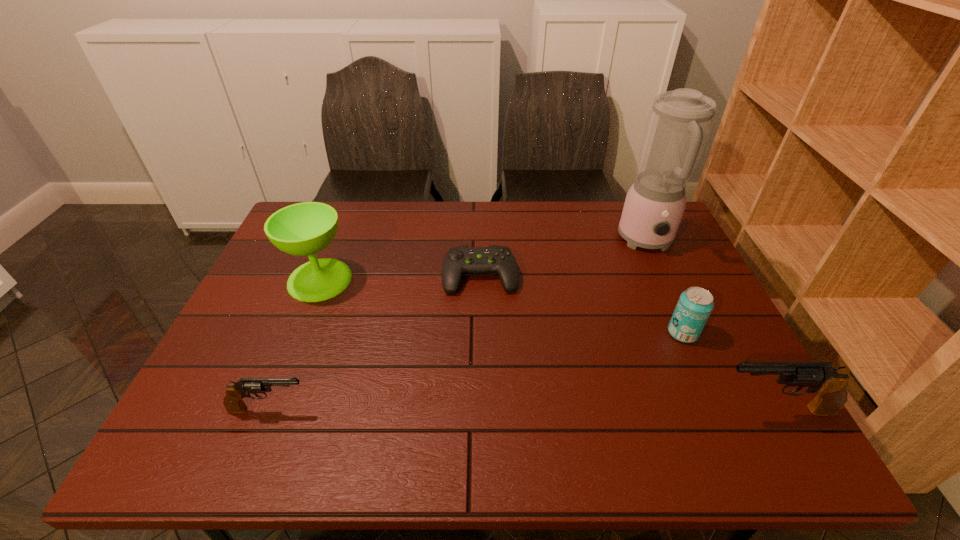
At what (x,y) coordinates should I click in order to perform the action: click on vacant space that's between the beer can and the taller gun. Please return your answer as a coordinate pair (x, y). This screenshot has height=540, width=960. Looking at the image, I should click on (729, 372).

Where is `vacant space that's between the second shortest object and the shortest object`? This screenshot has height=540, width=960. vacant space that's between the second shortest object and the shortest object is located at coordinates (374, 342).

Where is `vacant area that lies between the taller gun and the shorter gun`? The height and width of the screenshot is (540, 960). vacant area that lies between the taller gun and the shorter gun is located at coordinates (522, 409).

I want to click on vacant area that lies between the food processor and the third tallest object, so click(x=710, y=326).

Find the location of a particular element. blank region between the wineglass and the taller gun is located at coordinates (547, 345).

Find the location of `empty space that is in between the third object from left to right and the fourth shortest object`. empty space that is in between the third object from left to right and the fourth shortest object is located at coordinates (628, 342).

You are a GUI agent. You are given a task and a screenshot of the screen. Output one action in this format:
    pyautogui.click(x=<x>, y=<y>)
    Task: Click on the vacant area that lies between the left gun and the wineglass
    
    Given the screenshot: What is the action you would take?
    pyautogui.click(x=295, y=344)

The width and height of the screenshot is (960, 540). I want to click on vacant region between the fourth farthest object and the right gun, so click(x=729, y=372).

Find the location of `vacant area between the beer can and the left gun`. vacant area between the beer can and the left gun is located at coordinates (476, 371).

In order to click on object that is the third closest one to the shortest object in this screenshot , I will do `click(695, 305)`.